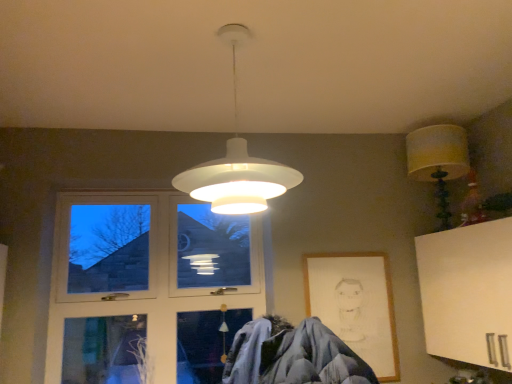
Describe the element at coordinates (148, 287) in the screenshot. I see `clear glass window at left` at that location.

What do you see at coordinates (438, 161) in the screenshot?
I see `yellow fabric lampshade at upper right, which is the 1th lamp in right-to-left order` at bounding box center [438, 161].

What is the approximate width of white matte pendant light at center, which is the 2th lamp in back-to-front order?

white matte pendant light at center, which is the 2th lamp in back-to-front order, is 19.57 inches in width.

Where is `wooden picture frame at lower right`? This screenshot has height=384, width=512. wooden picture frame at lower right is located at coordinates (355, 305).

Where is `window that is below the yellow fabric lampshade at upper right, the second lamp when ordered from front to back (from the image's perspective)`? This screenshot has width=512, height=384. window that is below the yellow fabric lampshade at upper right, the second lamp when ordered from front to back (from the image's perspective) is located at coordinates (148, 287).

Which of these two, clear glass window at left or yellow fabric lampshade at upper right, the second lamp when ordered from front to back, is wider?

yellow fabric lampshade at upper right, the second lamp when ordered from front to back, is wider.

From a real-world perspective, which object rests below the other?

clear glass window at left.

From the image's perspective, which is below, clear glass window at left or yellow fabric lampshade at upper right, the 1th lamp positioned from the back?

clear glass window at left appears lower in the image.

Is clear glass window at left positioned behind wooden picture frame at lower right?

Yes, clear glass window at left is further from the viewer.

How distant is clear glass window at left from wooden picture frame at lower right?

clear glass window at left and wooden picture frame at lower right are 32.03 inches apart.

From a real-world perspective, is clear glass window at left beneath wooden picture frame at lower right?

No.

Is wooden picture frame at lower right at the back of clear glass window at left?

clear glass window at left is not turned away from wooden picture frame at lower right.

Is there a large distance between white matte pendant light at center, the first lamp from the front, and clear glass window at left?

Yes, white matte pendant light at center, the first lamp from the front, and clear glass window at left are quite far apart.

Identify the location of window directly beneath the white matte pendant light at center, positioned as the first lamp in left-to-right order (from a real-world perspective). Image resolution: width=512 pixels, height=384 pixels. (148, 287).

In the scene shown: Is white matte pendant light at center, which is the 2th lamp in back-to-front order, aimed at clear glass window at left?

No, white matte pendant light at center, which is the 2th lamp in back-to-front order, is not oriented towards clear glass window at left.

From the image's perspective, which is below, white matte pendant light at center, which is the 2th lamp in back-to-front order, or clear glass window at left?

clear glass window at left.

From the image's perspective, is wooden picture frame at lower right located above or below clear glass window at left?

wooden picture frame at lower right is situated lower than clear glass window at left in the image.

Is wooden picture frame at lower right facing towards clear glass window at left?

No.

In order to click on window behind the wooden picture frame at lower right in this screenshot , I will do `click(148, 287)`.

Is wooden picture frame at lower right not within clear glass window at left?

Absolutely, wooden picture frame at lower right is external to clear glass window at left.

From a real-world perspective, relative to white matte pendant light at center, the first lamp from the front, is wooden picture frame at lower right vertically above or below?

In terms of real-world spatial position, wooden picture frame at lower right is below white matte pendant light at center, the first lamp from the front.

Can you tell me how much wooden picture frame at lower right and white matte pendant light at center, the first lamp from the front, differ in facing direction?

The facing directions of wooden picture frame at lower right and white matte pendant light at center, the first lamp from the front, are 4.96 degrees apart.

Is wooden picture frame at lower right not close to white matte pendant light at center, the first lamp from the front?

Yes.

Is wooden picture frame at lower right spatially inside white matte pendant light at center, positioned as the first lamp in left-to-right order, or outside of it?

wooden picture frame at lower right is not inside white matte pendant light at center, positioned as the first lamp in left-to-right order, it's outside.

In the scene shown: Could you tell me if yellow fabric lampshade at upper right, the 1th lamp positioned from the back, is facing wooden picture frame at lower right?

No, yellow fabric lampshade at upper right, the 1th lamp positioned from the back, is not aimed at wooden picture frame at lower right.

Which object is wider, yellow fabric lampshade at upper right, the second lamp when ordered from front to back, or wooden picture frame at lower right?

yellow fabric lampshade at upper right, the second lamp when ordered from front to back.

Locate an element on the screen. picture frame below the yellow fabric lampshade at upper right, the 1th lamp positioned from the back (from the image's perspective) is located at coordinates (355, 305).

Between yellow fabric lampshade at upper right, the second lamp when ordered from front to back, and wooden picture frame at lower right, which one has larger size?

With larger size is yellow fabric lampshade at upper right, the second lamp when ordered from front to back.

Does clear glass window at left turn towards white matte pendant light at center, which is the 2th lamp in back-to-front order?

Yes, clear glass window at left is facing white matte pendant light at center, which is the 2th lamp in back-to-front order.

From the image's perspective, which is below, clear glass window at left or white matte pendant light at center, which is the 2th lamp in back-to-front order?

From the image's view, clear glass window at left is below.

Would you say clear glass window at left is inside or outside white matte pendant light at center, which is the 2th lamp in back-to-front order?

clear glass window at left lies outside white matte pendant light at center, which is the 2th lamp in back-to-front order.

Is clear glass window at left shorter than white matte pendant light at center, which is the 2th lamp in back-to-front order?

Incorrect, the height of clear glass window at left does not fall short of that of white matte pendant light at center, which is the 2th lamp in back-to-front order.

From the image's perspective, which lamp is the 1st one above the clear glass window at left? Please provide its 2D coordinates.

[(438, 161)]

This screenshot has width=512, height=384. What are the coordinates of `window that is behind the wooden picture frame at lower right` in the screenshot? It's located at (148, 287).

Looking at the image, which one is located further to yellow fabric lampshade at upper right, which is the 1th lamp in right-to-left order, wooden picture frame at lower right or clear glass window at left?

clear glass window at left lies further to yellow fabric lampshade at upper right, which is the 1th lamp in right-to-left order, than the other object.

Estimate the real-world distances between objects in this image. Which object is further from clear glass window at left, wooden picture frame at lower right or white matte pendant light at center, which is the 2th lamp in back-to-front order?

white matte pendant light at center, which is the 2th lamp in back-to-front order, is positioned further to the anchor clear glass window at left.

When comparing their distances from white matte pendant light at center, the first lamp from the front, does clear glass window at left or yellow fabric lampshade at upper right, which is the 1th lamp in right-to-left order, seem closer?

The object closer to white matte pendant light at center, the first lamp from the front, is clear glass window at left.

Based on their spatial positions, is white matte pendant light at center, which is the 2th lamp in back-to-front order, or yellow fabric lampshade at upper right, the second lamp when ordered from front to back, closer to wooden picture frame at lower right?

Among the two, yellow fabric lampshade at upper right, the second lamp when ordered from front to back, is located nearer to wooden picture frame at lower right.

Based on their spatial positions, is white matte pendant light at center, the first lamp from the front, or clear glass window at left further from wooden picture frame at lower right?

white matte pendant light at center, the first lamp from the front, lies further to wooden picture frame at lower right than the other object.

Consider the image. From the image, which object appears to be farther from white matte pendant light at center, the first lamp from the front, yellow fabric lampshade at upper right, which appears as the second lamp when viewed from the left, or wooden picture frame at lower right?

yellow fabric lampshade at upper right, which appears as the second lamp when viewed from the left.

Which object lies further to the anchor point wooden picture frame at lower right, yellow fabric lampshade at upper right, which appears as the second lamp when viewed from the left, or clear glass window at left?

Based on the image, clear glass window at left appears to be further to wooden picture frame at lower right.

Based on their spatial positions, is clear glass window at left or white matte pendant light at center, which is the 2th lamp in back-to-front order, closer to wooden picture frame at lower right?

clear glass window at left.

The height and width of the screenshot is (384, 512). Find the location of `picture frame situated between clear glass window at left and yellow fabric lampshade at upper right, which appears as the second lamp when viewed from the left, from left to right`. picture frame situated between clear glass window at left and yellow fabric lampshade at upper right, which appears as the second lamp when viewed from the left, from left to right is located at coordinates (355, 305).

Identify the location of picture frame between white matte pendant light at center, which is the 2th lamp in back-to-front order, and clear glass window at left in the front-back direction. (355, 305).

Locate an element on the screen. This screenshot has width=512, height=384. picture frame positioned between white matte pendant light at center, the first lamp from the front, and yellow fabric lampshade at upper right, the 1th lamp positioned from the back, from near to far is located at coordinates (355, 305).

Where is `lamp between clear glass window at left and yellow fabric lampshade at upper right, which appears as the second lamp when viewed from the left, from left to right`? lamp between clear glass window at left and yellow fabric lampshade at upper right, which appears as the second lamp when viewed from the left, from left to right is located at coordinates tap(237, 163).